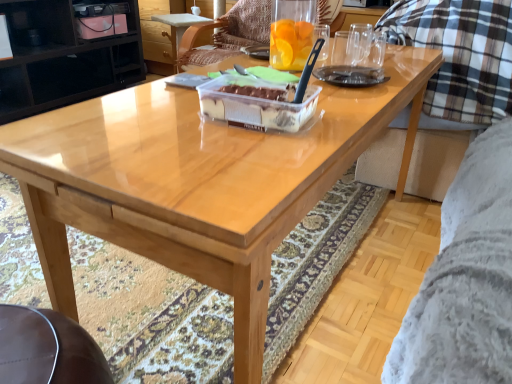
Question: Does wooden chair at center contain translucent plastic cake at center?

Choices:
 (A) no
 (B) yes

Answer: (A)

Question: Is wooden chair at center wider than translucent plastic cake at center?

Choices:
 (A) yes
 (B) no

Answer: (A)

Question: Is wooden chair at center smaller than translucent plastic cake at center?

Choices:
 (A) no
 (B) yes

Answer: (A)

Question: Can you confirm if wooden chair at center is positioned to the right of translucent plastic cake at center?

Choices:
 (A) no
 (B) yes

Answer: (A)

Question: Is wooden chair at center thinner than translucent plastic cake at center?

Choices:
 (A) no
 (B) yes

Answer: (A)

Question: Can you confirm if wooden chair at center is bigger than translucent plastic cake at center?

Choices:
 (A) no
 (B) yes

Answer: (B)

Question: Considering the relative sizes of wooden chair at center and black glossy cabinet at upper left in the image provided, is wooden chair at center smaller than black glossy cabinet at upper left?

Choices:
 (A) no
 (B) yes

Answer: (B)

Question: Is wooden chair at center shorter than black glossy cabinet at upper left?

Choices:
 (A) yes
 (B) no

Answer: (A)

Question: Is the position of wooden chair at center less distant than that of black glossy cabinet at upper left?

Choices:
 (A) no
 (B) yes

Answer: (B)

Question: Is wooden chair at center to the left of black glossy cabinet at upper left from the viewer's perspective?

Choices:
 (A) no
 (B) yes

Answer: (A)

Question: From the image's perspective, is wooden chair at center under black glossy cabinet at upper left?

Choices:
 (A) yes
 (B) no

Answer: (A)

Question: Is wooden chair at center positioned far away from black glossy cabinet at upper left?

Choices:
 (A) no
 (B) yes

Answer: (A)

Question: Would you say black glossy cabinet at upper left contains translucent plastic cake at center?

Choices:
 (A) yes
 (B) no

Answer: (B)